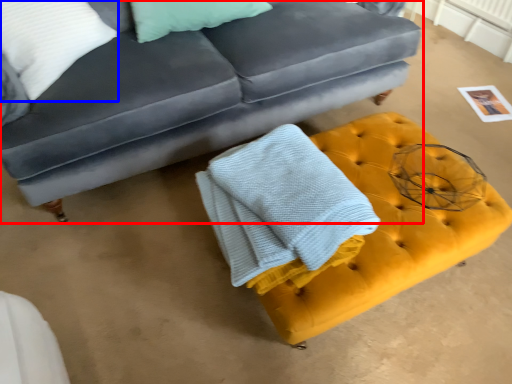
Question: Which of the following is the closest to the observer, studio couch (highlighted by a red box) or pillow (highlighted by a blue box)?

Choices:
 (A) studio couch
 (B) pillow

Answer: (A)